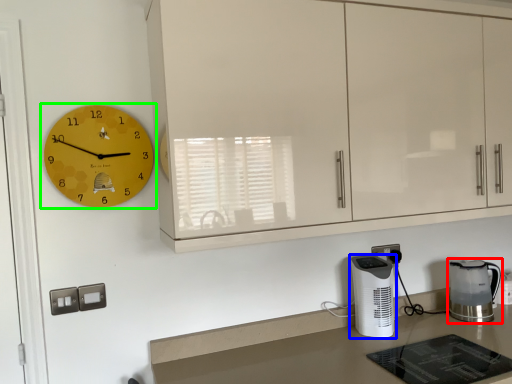
Question: Which is farther away from home appliance (highlighted by a red box)? home appliance (highlighted by a blue box) or wall clock (highlighted by a green box)?

Choices:
 (A) home appliance
 (B) wall clock

Answer: (B)